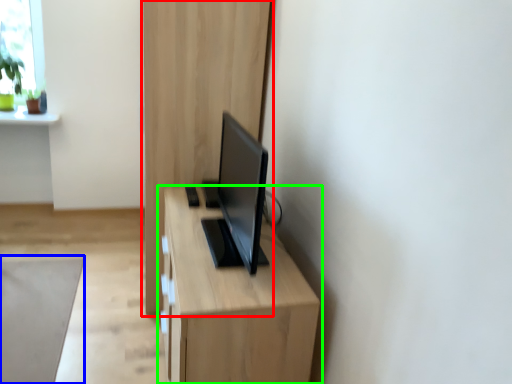
Question: Which is farther away from dresser (highlighted by a red box)? plain (highlighted by a blue box) or table (highlighted by a green box)?

Choices:
 (A) plain
 (B) table

Answer: (A)